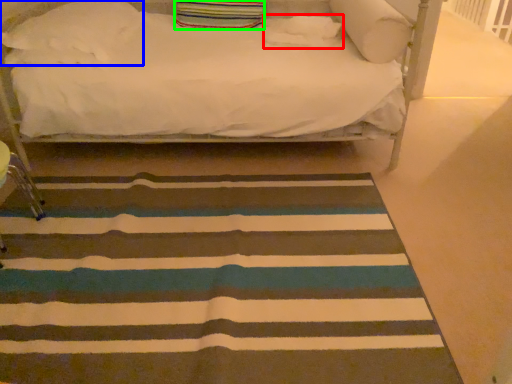
Question: Which object is positioned farthest from pillow (highlighted by a red box)? Select from pillow (highlighted by a blue box) and pillow (highlighted by a green box).

Choices:
 (A) pillow
 (B) pillow

Answer: (A)